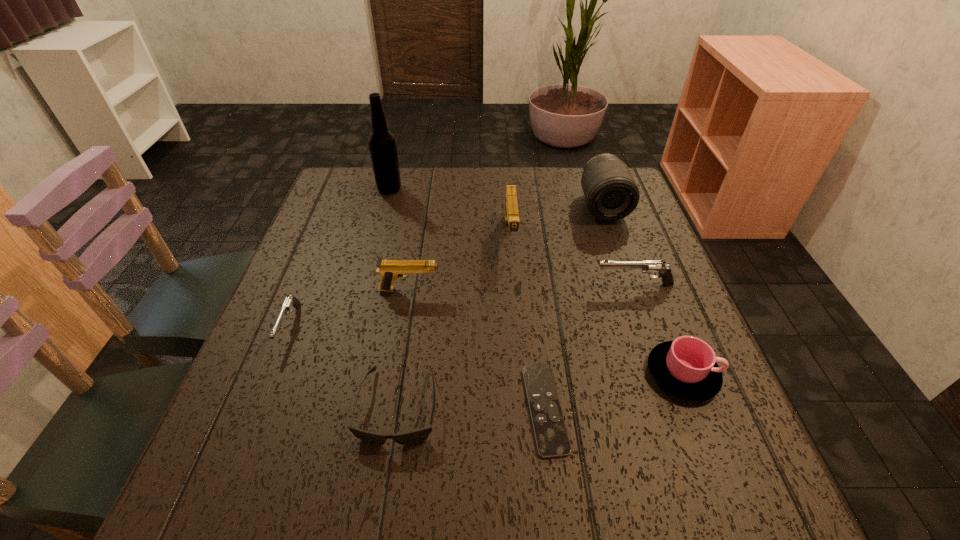
Locate which object ranks seventh in proximity to the beer bottle. Please provide its 2D coordinates. Your answer should be formatted as a tuple, i.e. [(x, y)], where the tuple contains the x and y coordinates of a point satisfying the conditions above.

[(551, 436)]

Where is `the second closest pistol relative to the remote control`? the second closest pistol relative to the remote control is located at coordinates (390, 270).

This screenshot has width=960, height=540. I want to click on the third closest pistol to the second pistol from right to left, so click(x=290, y=302).

You are a GUI agent. You are given a task and a screenshot of the screen. Output one action in this format:
    pyautogui.click(x=<x>, y=<y>)
    Task: Click on the free space that satisfies the following two spatial constraints: 1. on the surface of the telephoto lens; 2. at the barrel of the nearer tan pistol
    This screenshot has width=960, height=540.
    Given the screenshot: What is the action you would take?
    coord(632,290)

Image resolution: width=960 pixels, height=540 pixels. Find the location of `free space that satisfies the following two spatial constraints: 1. at the barrel of the shortest object; 2. on the right side of the left tan pistol`. free space that satisfies the following two spatial constraints: 1. at the barrel of the shortest object; 2. on the right side of the left tan pistol is located at coordinates (390, 409).

Locate an element on the screen. vacant position in the image that satisfies the following two spatial constraints: 1. on the front-facing side of the third tallest pistol; 2. on the front-facing side of the sunglasses is located at coordinates (677, 406).

Identify the location of free space that satisfies the following two spatial constraints: 1. at the barrel of the farther tan pistol; 2. on the right side of the shortest object. pos(524,409).

I want to click on vacant space that satisfies the following two spatial constraints: 1. on the surface of the gray telephoto lens; 2. at the barrel of the second pistol from left to right, so click(x=632, y=290).